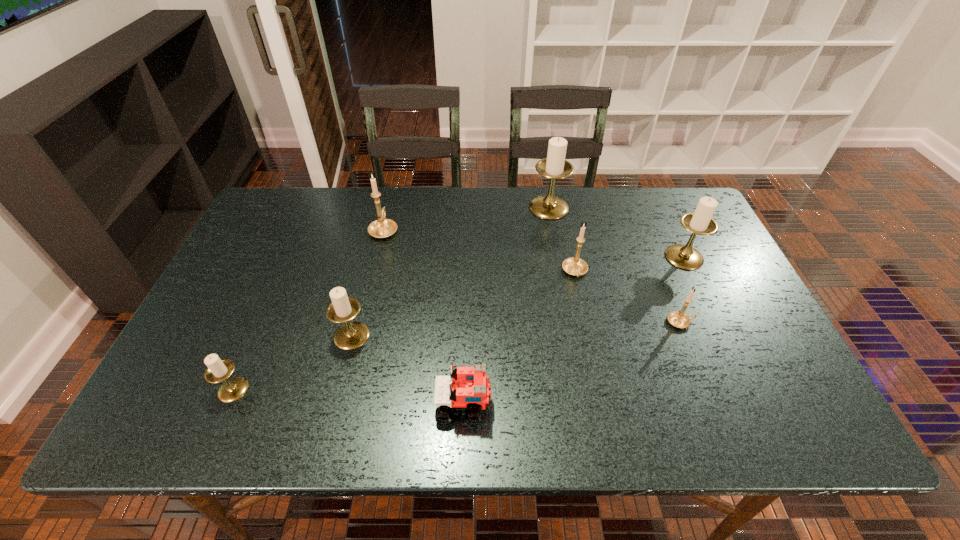
This screenshot has height=540, width=960. Identify the location of free space between the biggest gold candle holder and the nearest candle holder. (309, 309).

Identify the location of free space that is in between the tallest object and the red Lego. (506, 306).

Identify the location of blank region between the leftmost white candle holder and the nearest gold candle holder. (457, 356).

I want to click on empty location between the second nearest gold candle holder and the biggest gold candle holder, so click(x=479, y=251).

Locate an element on the screen. The image size is (960, 540). free space that is in between the second farthest white candle holder and the rightmost gold candle holder is located at coordinates (683, 289).

The height and width of the screenshot is (540, 960). I want to click on object that is the sixth closest one to the nearest candle holder, so click(x=678, y=319).

Choose which object is the seventh nearest neighbor to the farthest gold candle holder. Please provide its 2D coordinates. Your answer should be formatted as a tuple, i.e. [(x, y)], where the tuple contains the x and y coordinates of a point satisfying the conditions above.

[(700, 222)]

In order to click on the fourth closest candle holder to the red Lego in this screenshot , I will do `click(678, 319)`.

Select which candle holder appears as the closest to the second farthest white candle holder. Please provide its 2D coordinates. Your answer should be formatted as a tuple, i.e. [(x, y)], where the tuple contains the x and y coordinates of a point satisfying the conditions above.

[(678, 319)]

Point out which white candle holder is positioned as the nearest to the smallest white candle holder. Please provide its 2D coordinates. Your answer should be formatted as a tuple, i.e. [(x, y)], where the tuple contains the x and y coordinates of a point satisfying the conditions above.

[(351, 335)]